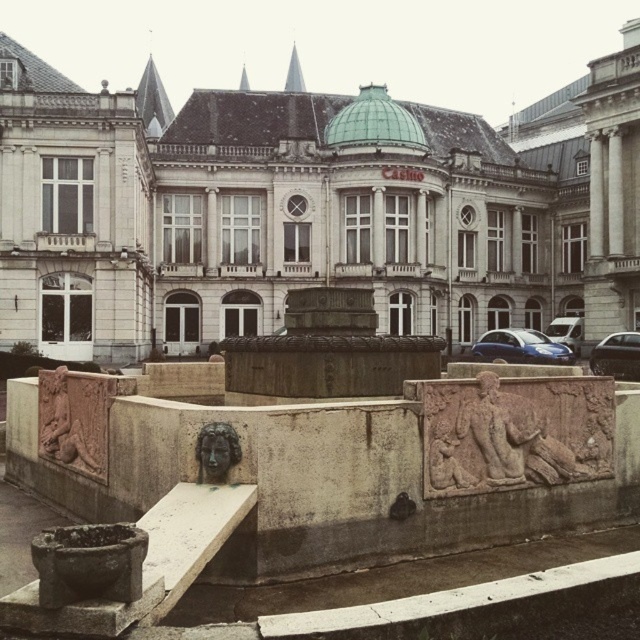
How distant is white stone palace at center from bronze textured face at center?

white stone palace at center is 62.17 meters away from bronze textured face at center.

Does white stone palace at center appear under bronze textured face at center?

No.

This screenshot has height=640, width=640. Find the location of `white stone palace at center`. white stone palace at center is located at coordinates (308, 209).

Which is below, white stone palace at center or carved stone relief at center?

Positioned lower is carved stone relief at center.

Does white stone palace at center have a larger size compared to carved stone relief at center?

Yes.

Which is behind, point (637, 161) or point (525, 397)?

Positioned behind is point (637, 161).

At what (x,y) coordinates should I click in order to perform the action: click on white stone palace at center. Please return your answer as a coordinate pair (x, y). Looking at the image, I should click on (308, 209).

This screenshot has height=640, width=640. Find the location of `white stone palace at center`. white stone palace at center is located at coordinates (308, 209).

Between white stone palace at center and carved stone figure at lower left, which one has less height?

carved stone figure at lower left is shorter.

This screenshot has height=640, width=640. What do you see at coordinates (308, 209) in the screenshot? I see `white stone palace at center` at bounding box center [308, 209].

You are a GUI agent. You are given a task and a screenshot of the screen. Output one action in this format:
    pyautogui.click(x=<x>, y=<y>)
    Task: Click on the white stone palace at center
    This screenshot has height=640, width=640.
    Given the screenshot: What is the action you would take?
    pyautogui.click(x=308, y=209)